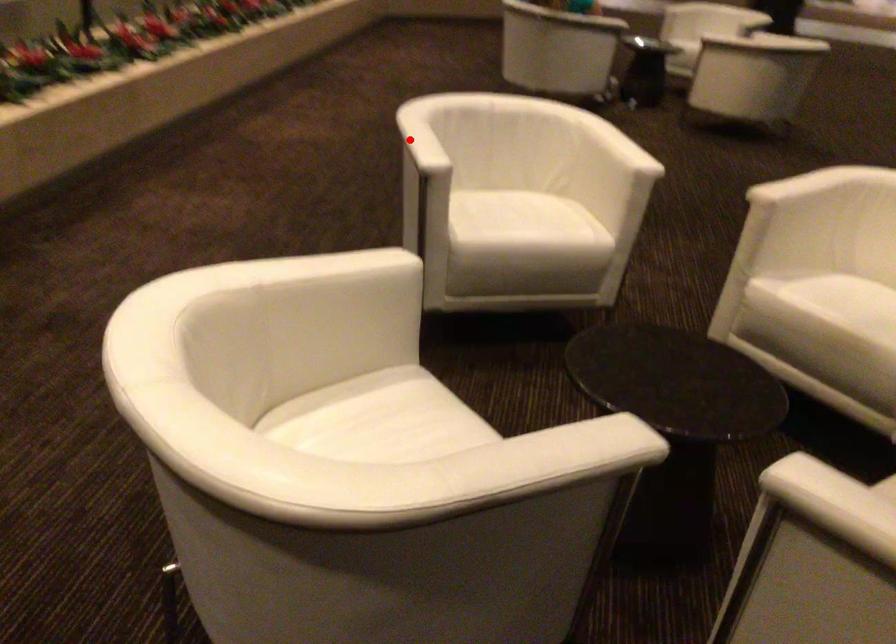
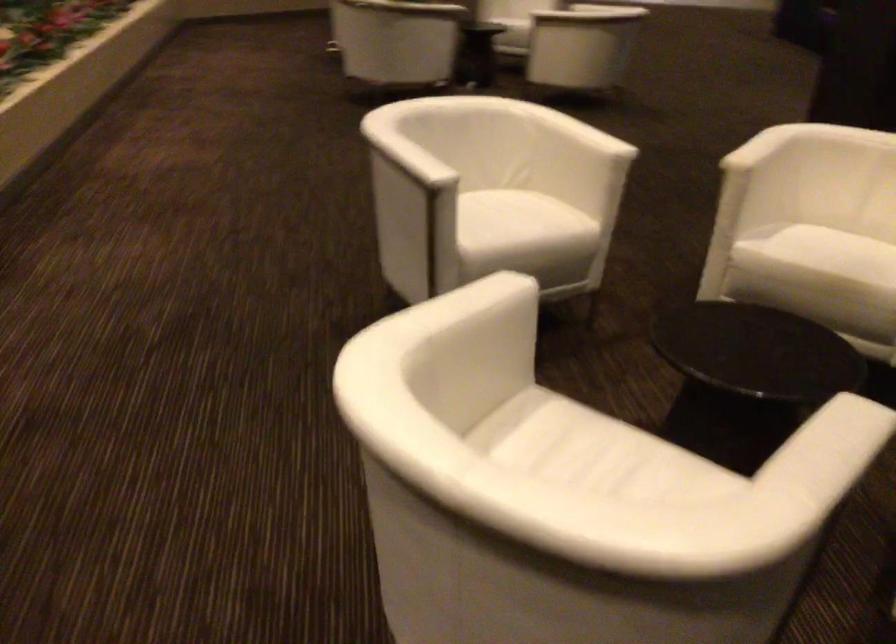
Find the pixel in the second image that matches the highlighted location in the first image.

(406, 158)